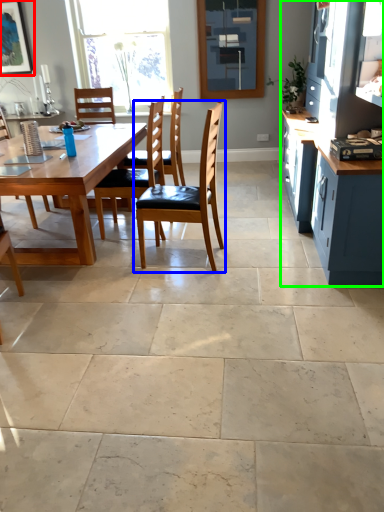
Question: Which object is the closest to the picture frame (highlighted by a red box)? Choose among these: chair (highlighted by a blue box) or cabinetry (highlighted by a green box).

Choices:
 (A) chair
 (B) cabinetry

Answer: (A)